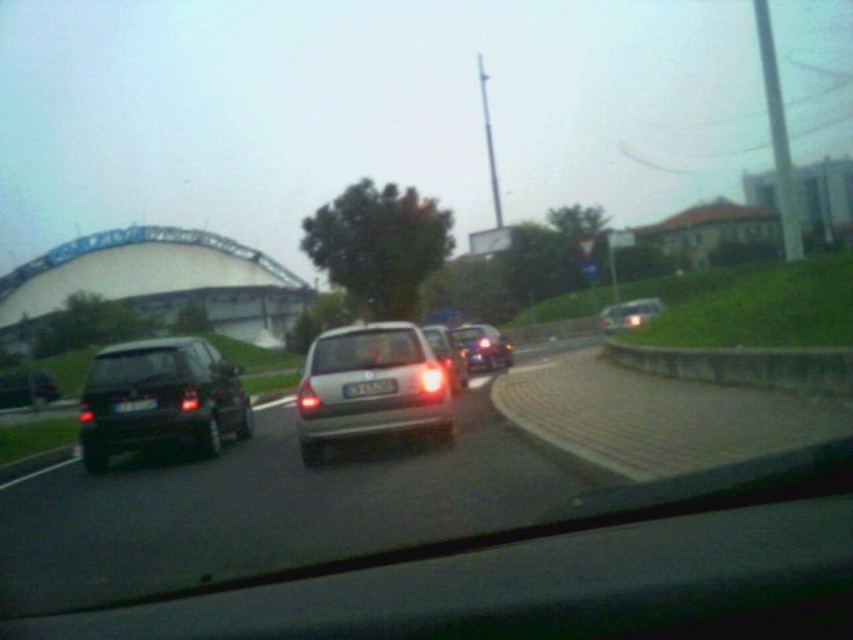
Question: Is shiny silver car at center wider than black matte car at left?

Choices:
 (A) yes
 (B) no

Answer: (A)

Question: Which point is closer to the camera taking this photo?

Choices:
 (A) (149, 406)
 (B) (498, 356)
 (C) (36, 378)
 (D) (415, 381)

Answer: (D)

Question: Among these points, which one is nearest to the camera?

Choices:
 (A) (346, 394)
 (B) (502, 365)

Answer: (A)

Question: Which object is farther from the camera taking this photo?

Choices:
 (A) satin silver sedan at center
 (B) black matte car at left
 (C) shiny silver car at center

Answer: (B)

Question: Can you confirm if black matte car at left is positioned to the left of white plastic license plate at center?

Choices:
 (A) no
 (B) yes

Answer: (B)

Question: Is matte black car at left to the left of satin silver car at center from the viewer's perspective?

Choices:
 (A) no
 (B) yes

Answer: (B)